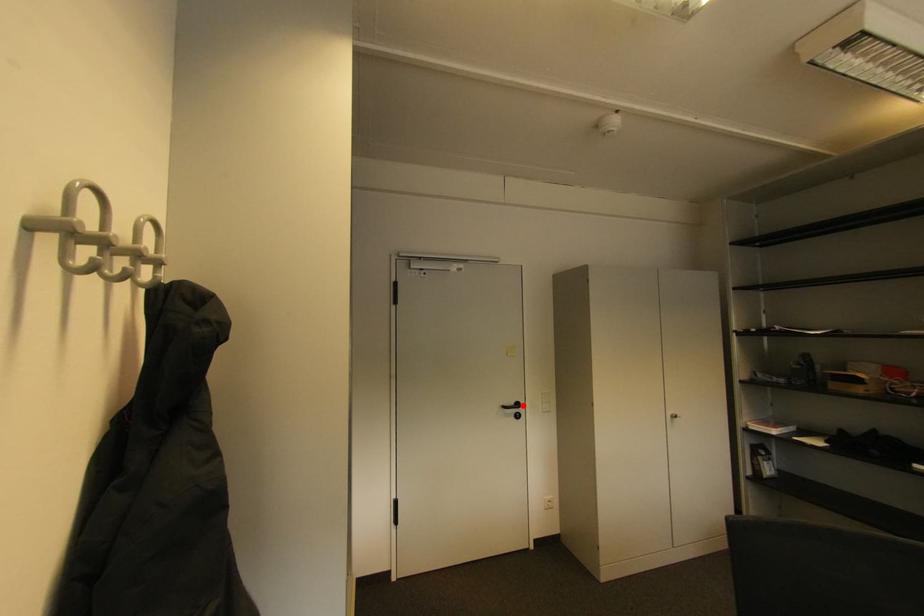
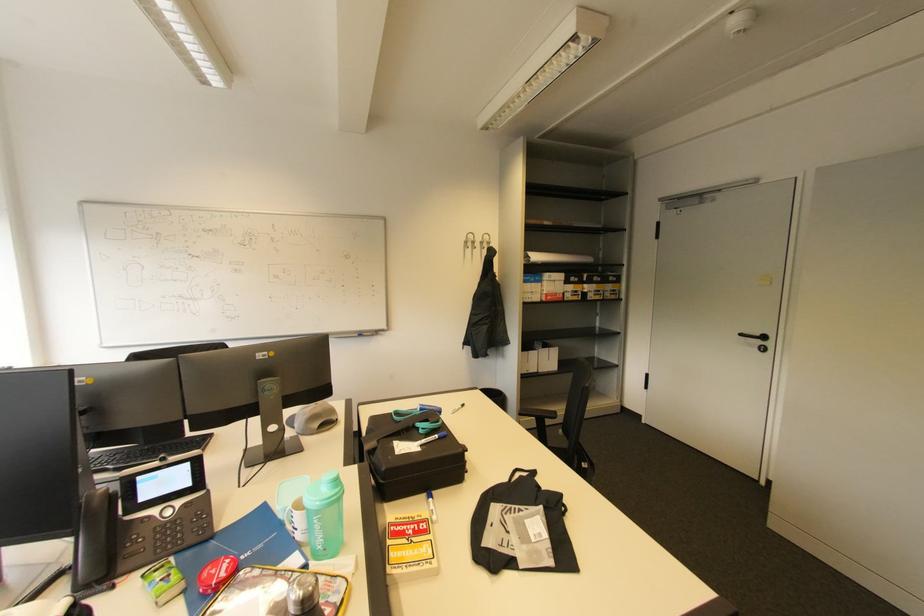
In the second image, find the point that corresponds to the highlighted location in the first image.

(769, 339)